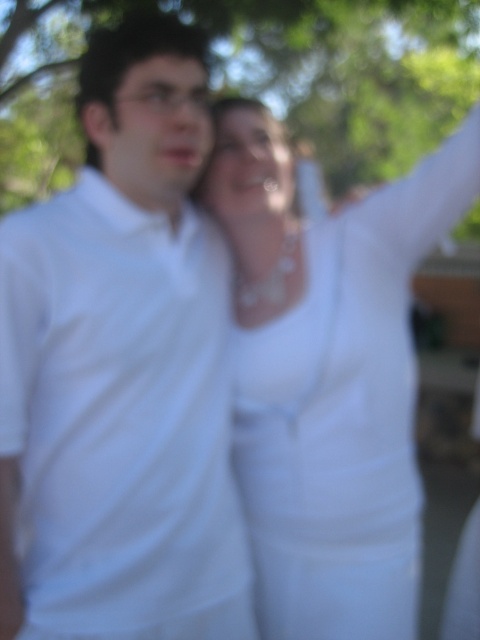
You are using a photo editing software and want to place a sticker on the white matte shirt at left. The software requires you to input coordinates between 0 and 1 for the center of the object. What coordinates should you enter?

You should enter the coordinates (121, 371) as the center point for placing the sticker on the white matte shirt at left.

You are a photographer trying to capture a clear shot of the white fabric dress at upper center and the green leafy tree at upper center in the image. Given the scene is slightly out of focus, which object would be easier to adjust the camera focus on, considering their sizes?

The white fabric dress at upper center is thinner than the green leafy tree at upper center, so the green leafy tree at upper center would be easier to adjust the camera focus on because it has a larger size and more distinct edges compared to the thinner dress.

In the scene shown: You are a photographer trying to capture a closeup shot of the white fabric dress at upper center. Given that your camera has a minimum focusing distance of 6 feet, will you be able to take the photo without moving closer?

The white fabric dress at upper center is 5.50 feet from the camera, which is within the camera minimum focusing distance of 6 feet. Therefore, you can take the photo without moving closer.